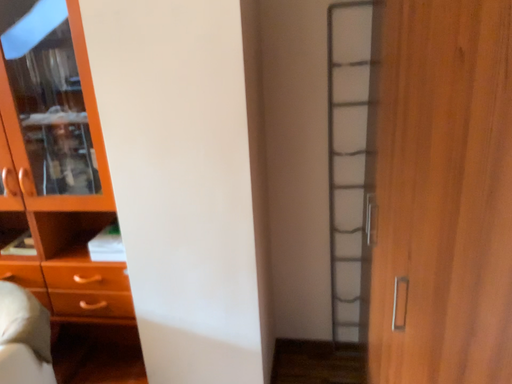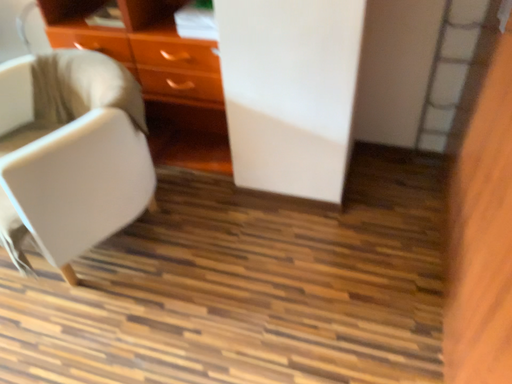
Question: Which way did the camera rotate in the video?

Choices:
 (A) rotated upward
 (B) rotated downward

Answer: (B)